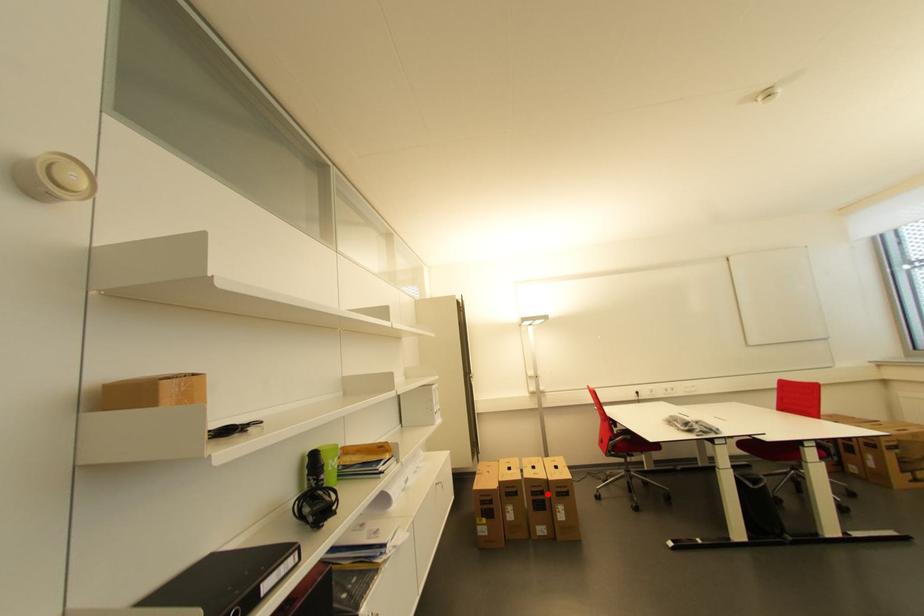
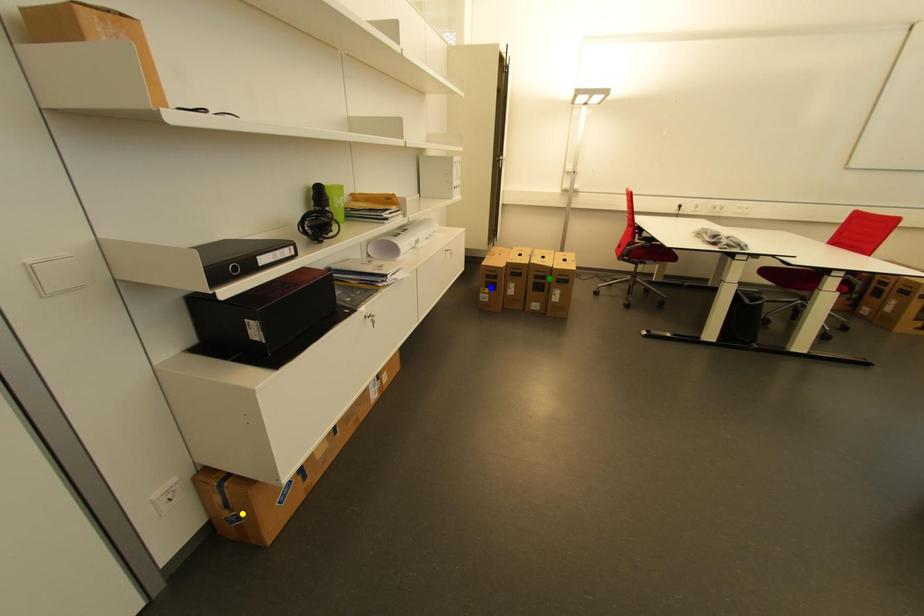
Question: I am providing you with two images of the same scene from different viewpoints. A red point is marked on the first image. You are given multiple points on the second image. Which mark in image 2 goes with the point in image 1?

Choices:
 (A) green point
 (B) blue point
 (C) yellow point

Answer: (A)